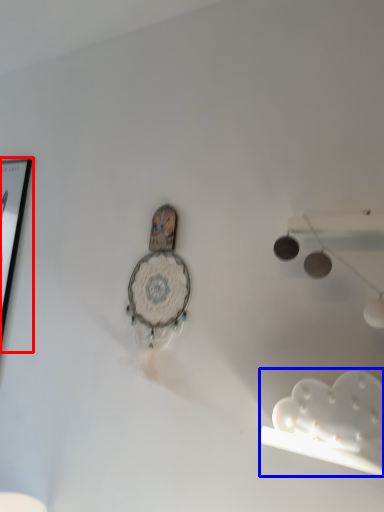
Question: Which object appears farthest to the camera in this image, picture frame (highlighted by a red box) or lamp (highlighted by a blue box)?

Choices:
 (A) picture frame
 (B) lamp

Answer: (A)